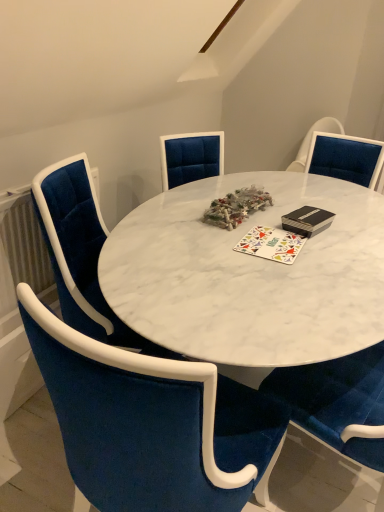
Question: From a real-world perspective, does velvet blue chair at center, positioned as the first chair in front-to-back order, sit lower than velvet blue chair at left, the 1th chair in the back-to-front sequence?

Choices:
 (A) no
 (B) yes

Answer: (A)

Question: From the image's perspective, does velvet blue chair at center, positioned as the first chair in front-to-back order, appear lower than velvet blue chair at left, the 1th chair in the back-to-front sequence?

Choices:
 (A) yes
 (B) no

Answer: (A)

Question: Are velvet blue chair at center, positioned as the first chair in front-to-back order, and velvet blue chair at left, the 1th chair in the back-to-front sequence, far apart?

Choices:
 (A) yes
 (B) no

Answer: (B)

Question: From the image's perspective, is velvet blue chair at center, positioned as the first chair in front-to-back order, over velvet blue chair at left, the 1th chair in the back-to-front sequence?

Choices:
 (A) yes
 (B) no

Answer: (B)

Question: Considering the relative sizes of velvet blue chair at center, the 2th chair positioned from the back, and velvet blue chair at left, the 1th chair in the back-to-front sequence, in the image provided, is velvet blue chair at center, the 2th chair positioned from the back, bigger than velvet blue chair at left, the 1th chair in the back-to-front sequence,?

Choices:
 (A) no
 (B) yes

Answer: (B)

Question: Considering the relative sizes of velvet blue chair at center, the 2th chair positioned from the back, and velvet blue chair at left, the 1th chair in the back-to-front sequence, in the image provided, is velvet blue chair at center, the 2th chair positioned from the back, taller than velvet blue chair at left, the 1th chair in the back-to-front sequence,?

Choices:
 (A) no
 (B) yes

Answer: (B)

Question: Can you confirm if multicolored fabric mat at center is positioned to the left of velvet blue chair at left, the 2th chair when ordered from front to back?

Choices:
 (A) no
 (B) yes

Answer: (A)

Question: Is multicolored fabric mat at center oriented towards velvet blue chair at left, the 2th chair when ordered from front to back?

Choices:
 (A) yes
 (B) no

Answer: (B)

Question: Would you consider multicolored fabric mat at center to be distant from velvet blue chair at left, the 1th chair in the back-to-front sequence?

Choices:
 (A) yes
 (B) no

Answer: (B)

Question: Is multicolored fabric mat at center wider than velvet blue chair at left, the 1th chair in the back-to-front sequence?

Choices:
 (A) yes
 (B) no

Answer: (B)

Question: Is multicolored fabric mat at center surrounding velvet blue chair at left, the 1th chair in the back-to-front sequence?

Choices:
 (A) yes
 (B) no

Answer: (B)

Question: Is multicolored fabric mat at center bigger than velvet blue chair at left, the 1th chair in the back-to-front sequence?

Choices:
 (A) no
 (B) yes

Answer: (A)

Question: Is the position of velvet blue chair at left, the 2th chair when ordered from front to back, more distant than that of multicolored fabric mat at center?

Choices:
 (A) yes
 (B) no

Answer: (B)